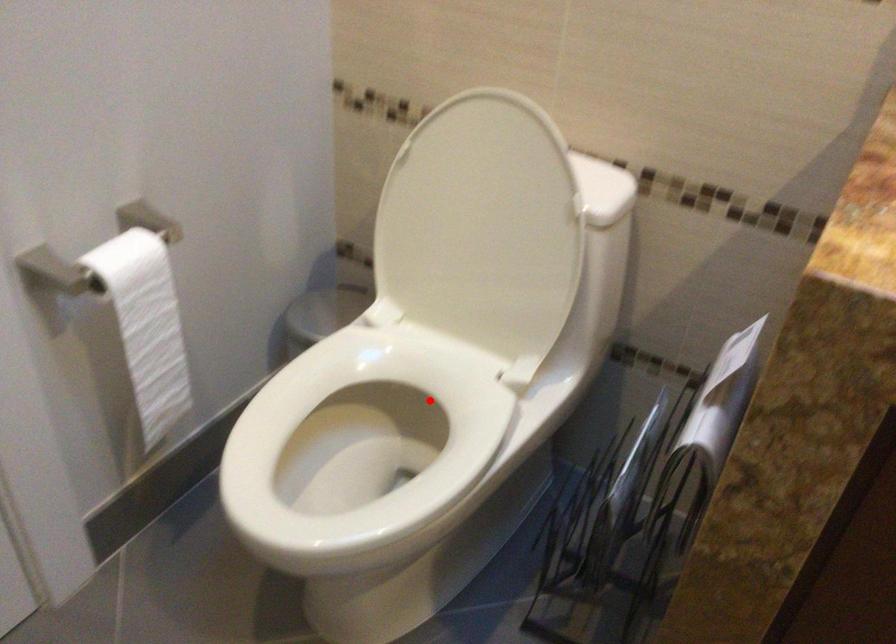
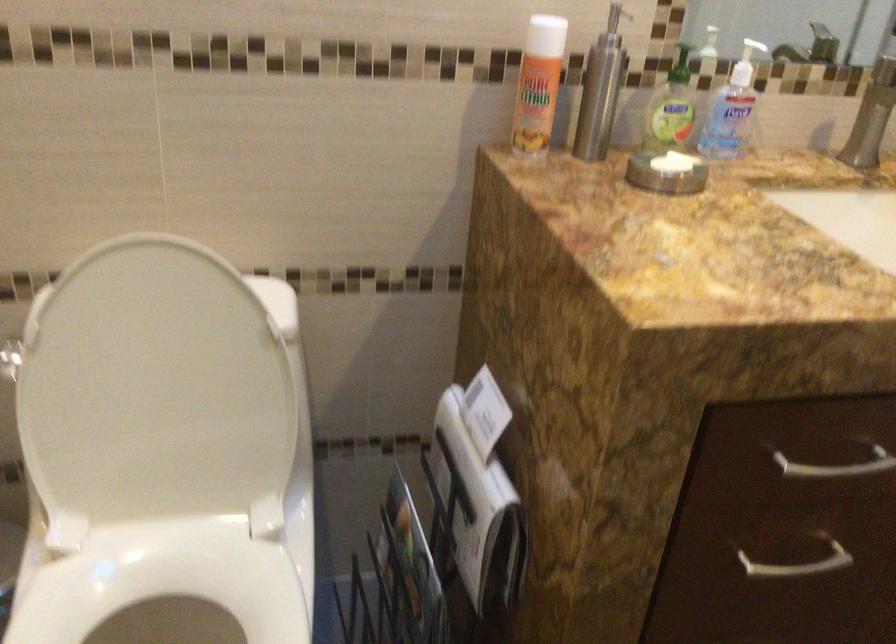
Question: A red point is marked in image1. In image2, is the corresponding 3D point closer to the camera or farther? Reply with the corresponding letter.

Choices:
 (A) The corresponding 3D point is closer.
 (B) The corresponding 3D point is farther.

Answer: (A)